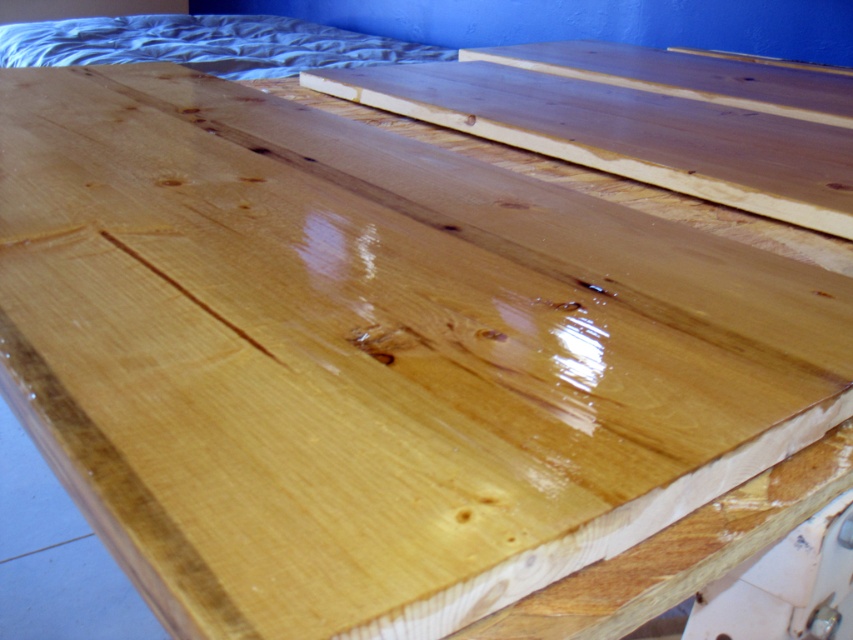
Between matte wood bed at upper center and satin wood plank at upper right, which one is positioned lower?

satin wood plank at upper right is below.

Can you confirm if matte wood bed at upper center is smaller than satin wood plank at upper right?

No, matte wood bed at upper center is not smaller than satin wood plank at upper right.

Where is `matte wood bed at upper center`? The image size is (853, 640). matte wood bed at upper center is located at coordinates (204, 44).

Identify the location of matte wood bed at upper center. (204, 44).

Which is above, natural wood plank at upper right or satin wood plank at upper right?

Positioned higher is satin wood plank at upper right.

Does natural wood plank at upper right have a larger size compared to satin wood plank at upper right?

Incorrect, natural wood plank at upper right is not larger than satin wood plank at upper right.

Is point (689, 108) positioned after point (827, 76)?

That is False.

Find the location of a particular element. This screenshot has height=640, width=853. natural wood plank at upper right is located at coordinates (625, 132).

Between natural wood plank at upper right and matte wood bed at upper center, which one has more height?

matte wood bed at upper center

Between point (537, 147) and point (395, 38), which one is positioned behind?

The point (395, 38) is behind.

In order to click on natural wood plank at upper right in this screenshot , I will do (625, 132).